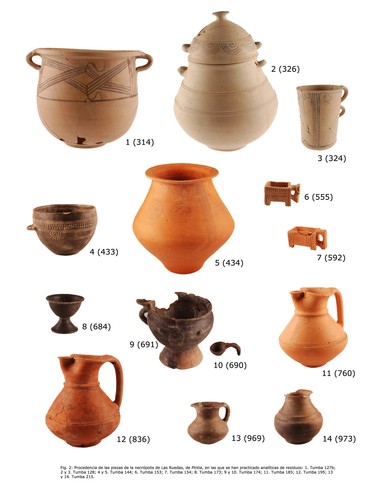
Locate an element on the screen. The width and height of the screenshot is (376, 500). light brown cup upper right is located at coordinates pos(328,114).